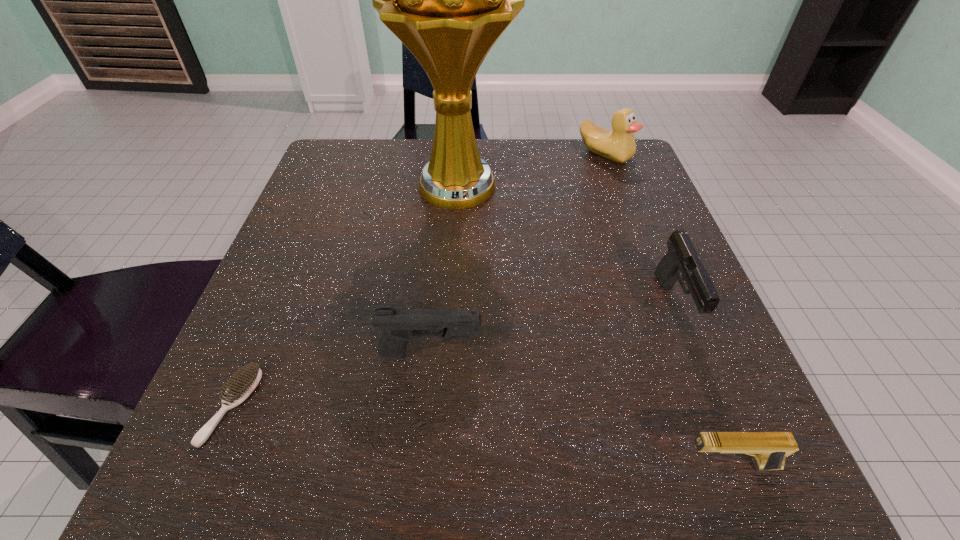
Find the location of a particular element. The height and width of the screenshot is (540, 960). scrubbing brush situated at the near edge is located at coordinates (241, 386).

The height and width of the screenshot is (540, 960). I want to click on object located in the left edge section of the desktop, so click(241, 386).

Where is `duck that is positioned at the right edge`? duck that is positioned at the right edge is located at coordinates (618, 145).

At what (x,y) coordinates should I click in order to perform the action: click on object located in the near left corner section of the desktop. Please return your answer as a coordinate pair (x, y). Looking at the image, I should click on (241, 386).

At what (x,y) coordinates should I click in order to perform the action: click on object present at the far right corner. Please return your answer as a coordinate pair (x, y). Image resolution: width=960 pixels, height=540 pixels. Looking at the image, I should click on (618, 145).

This screenshot has width=960, height=540. Identify the location of object that is at the near right corner. (770, 449).

In the image, there is a desktop. Where is `vacant space at the far edge`? The image size is (960, 540). vacant space at the far edge is located at coordinates (399, 142).

In the image, there is a desktop. Find the location of `free space at the near edge`. free space at the near edge is located at coordinates (544, 503).

The width and height of the screenshot is (960, 540). In the image, there is a desktop. What are the coordinates of `blank space at the left edge` in the screenshot? It's located at (356, 204).

What are the coordinates of `vacant space at the right edge` in the screenshot? It's located at (736, 384).